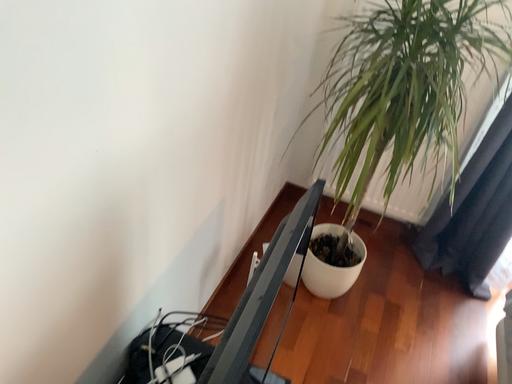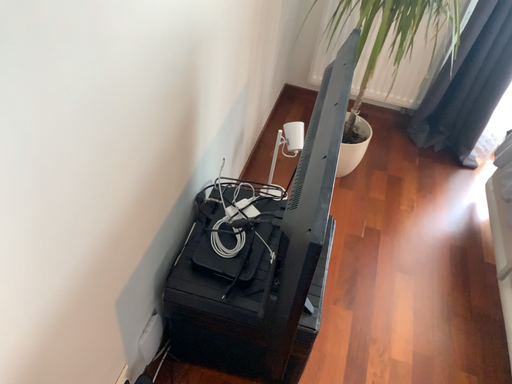
Question: Which way did the camera rotate in the video?

Choices:
 (A) rotated upward
 (B) rotated downward

Answer: (B)